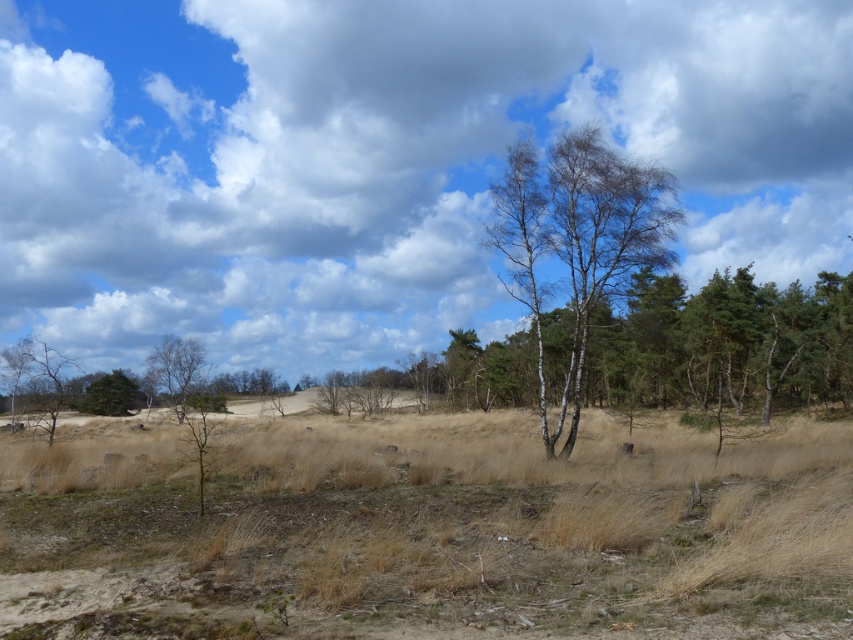
Question: Is bare birch trees at center thinner than green matte tree at lower left?

Choices:
 (A) no
 (B) yes

Answer: (A)

Question: Considering the relative positions of bare birch trees at center and green matte tree at lower left in the image provided, where is bare birch trees at center located with respect to green matte tree at lower left?

Choices:
 (A) below
 (B) above

Answer: (B)

Question: Among these objects, which one is farthest from the camera?

Choices:
 (A) bare birch trees at center
 (B) white fluffy cloud at upper center
 (C) green matte tree at lower left

Answer: (C)

Question: Observing the image, what is the correct spatial positioning of bare birch trees at center in reference to green matte tree at lower left?

Choices:
 (A) left
 (B) right

Answer: (B)

Question: Which point appears closest to the camera in this image?

Choices:
 (A) (572, 166)
 (B) (111, 408)
 (C) (579, 58)

Answer: (A)

Question: Which point is farther to the camera?

Choices:
 (A) bare birch trees at center
 (B) green matte tree at lower left

Answer: (B)